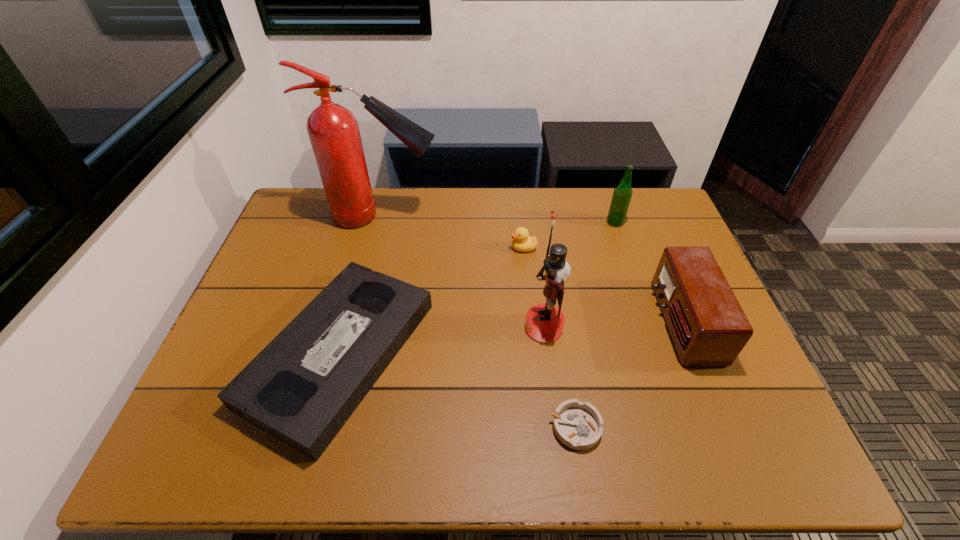
Locate an element on the screen. The width and height of the screenshot is (960, 540). free spot located on the face of the duckling is located at coordinates (431, 248).

Where is `vacant area situated 0.080m on the left of the videotape`? This screenshot has width=960, height=540. vacant area situated 0.080m on the left of the videotape is located at coordinates (220, 354).

I want to click on blank space located on the left of the shortest object, so click(x=455, y=427).

The image size is (960, 540). What are the coordinates of `fire extinguisher situated at the far edge` in the screenshot? It's located at (333, 130).

Where is `beer bottle that is at the far edge`? This screenshot has width=960, height=540. beer bottle that is at the far edge is located at coordinates (622, 194).

You are a GUI agent. You are given a task and a screenshot of the screen. Output one action in this format:
    pyautogui.click(x=<x>, y=<y>)
    Task: Click on the videotape that is at the near edge
    
    Given the screenshot: What is the action you would take?
    pos(302,388)

You are a GUI agent. You are given a task and a screenshot of the screen. Output one action in this format:
    pyautogui.click(x=<x>, y=<y>)
    Task: Click on the ashtray located in the near edge section of the desktop
    This screenshot has width=960, height=540.
    Given the screenshot: What is the action you would take?
    pyautogui.click(x=578, y=425)

At what (x,y) coordinates should I click in order to perform the action: click on fire extinguisher present at the left edge. Please return your answer as a coordinate pair (x, y). This screenshot has height=540, width=960. Looking at the image, I should click on (333, 130).

Locate an element on the screen. This screenshot has width=960, height=540. videotape that is at the left edge is located at coordinates (302, 388).

At what (x,y) coordinates should I click in order to perform the action: click on object at the right edge. Please return your answer as a coordinate pair (x, y). The image size is (960, 540). Looking at the image, I should click on (708, 326).